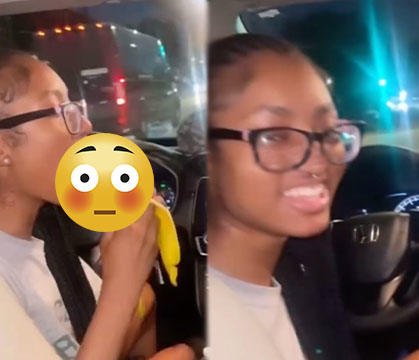
Where is `lights`? This screenshot has width=419, height=360. lights is located at coordinates (401, 107).